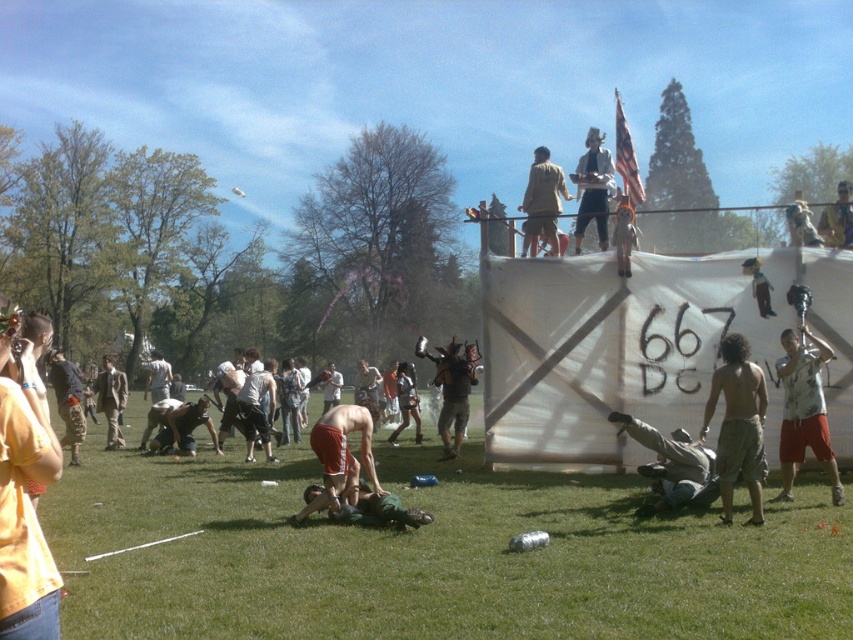
Question: Which object is positioned closest to the light brown leather jacket at upper center?

Choices:
 (A) green grass at lower center
 (B) camouflage fabric person at lower center
 (C) orange shorts at center

Answer: (B)

Question: Does camouflage fabric person at lower center lie behind khaki cotton shirt at upper center?

Choices:
 (A) yes
 (B) no

Answer: (B)

Question: Which point is farther to the camera?

Choices:
 (A) camouflage pants at lower left
 (B) green grass at lower center
 (C) light green fabric shirt at right

Answer: (A)

Question: Does green grass at lower center come in front of khaki cotton shirt at upper center?

Choices:
 (A) no
 (B) yes

Answer: (B)

Question: Is light green fabric shirt at right bigger than khaki cotton shirt at upper center?

Choices:
 (A) no
 (B) yes

Answer: (A)

Question: Among these points, which one is nearest to the camera?

Choices:
 (A) (757, 634)
 (B) (360, 444)

Answer: (A)